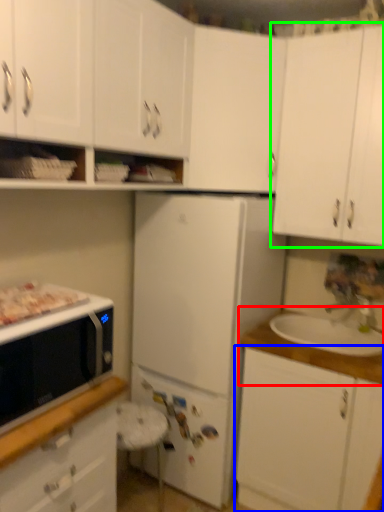
Question: Which object is positioned closest to countertop (highlighted by a red box)? Select from cabinetry (highlighted by a blue box) and cabinetry (highlighted by a green box).

Choices:
 (A) cabinetry
 (B) cabinetry

Answer: (A)